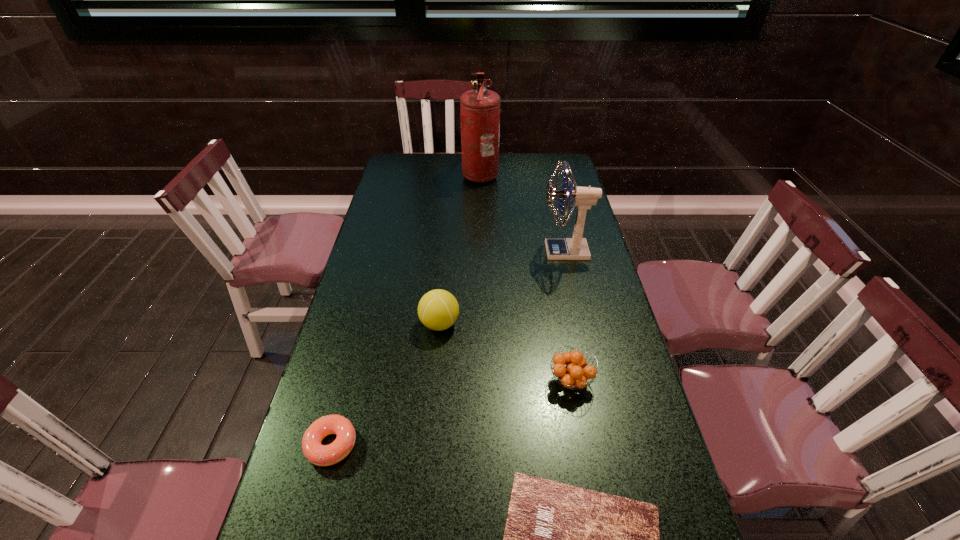
In order to click on free space between the doughnut and the fire extinguisher in this screenshot , I will do `click(406, 309)`.

This screenshot has height=540, width=960. Find the location of `vacant space that is in between the fifth nearest object and the third shortest object`. vacant space that is in between the fifth nearest object and the third shortest object is located at coordinates (568, 316).

Image resolution: width=960 pixels, height=540 pixels. I want to click on empty space that is in between the tallest object and the tennis ball, so click(460, 249).

This screenshot has width=960, height=540. In order to click on vacant space that's between the fifth farthest object and the second tallest object in this screenshot , I will do `click(448, 348)`.

Locate which object is the second closest to the tennis ball. Please provide its 2D coordinates. Your answer should be formatted as a tuple, i.e. [(x, y)], where the tuple contains the x and y coordinates of a point satisfying the conditions above.

[(321, 455)]

I want to click on object that is the closest one to the third farthest object, so click(x=575, y=374).

I want to click on vacant region that satisfies the following two spatial constraints: 1. on the front-facing side of the fan; 2. on the front side of the orange fruit, so click(x=595, y=381).

At what (x,y) coordinates should I click in order to perform the action: click on free space that satisfies the following two spatial constraints: 1. at the front of the third shortest object where the nozzle is aimed; 2. on the left side of the tallest object. Please return your answer as a coordinate pair (x, y). This screenshot has width=960, height=540. Looking at the image, I should click on pos(480,381).